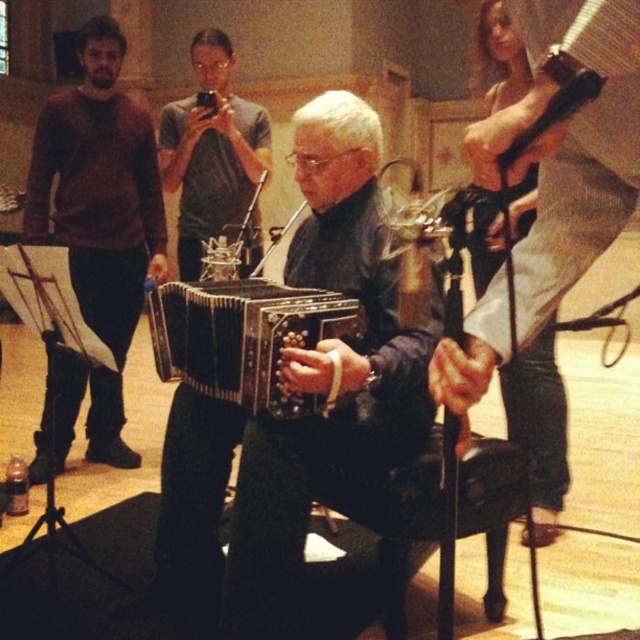
Can you confirm if matte black accordion at center is bigger than black matte accordion at center?

No.

Can you confirm if matte black accordion at center is smaller than black matte accordion at center?

Indeed, matte black accordion at center has a smaller size compared to black matte accordion at center.

Find the location of a particular element. Image resolution: width=640 pixels, height=640 pixels. matte black accordion at center is located at coordinates (576, 198).

You are a GUI agent. You are given a task and a screenshot of the screen. Output one action in this format:
    pyautogui.click(x=<x>, y=<y>)
    Task: Click on the matte black accordion at center
    The width and height of the screenshot is (640, 640).
    Given the screenshot: What is the action you would take?
    pyautogui.click(x=576, y=198)

How far apart are wooden accordion at center and matte gray shirt at center?

The distance of wooden accordion at center from matte gray shirt at center is 1.30 meters.

Describe the element at coordinates (300, 390) in the screenshot. I see `wooden accordion at center` at that location.

The image size is (640, 640). I want to click on wooden accordion at center, so click(x=300, y=390).

Which of these two, matte black accordion at center or matte gray shirt at center, stands taller?

With more height is matte gray shirt at center.

Does matte black accordion at center have a larger size compared to matte gray shirt at center?

Actually, matte black accordion at center might be smaller than matte gray shirt at center.

Locate an element on the screen. Image resolution: width=640 pixels, height=640 pixels. matte black accordion at center is located at coordinates (576, 198).